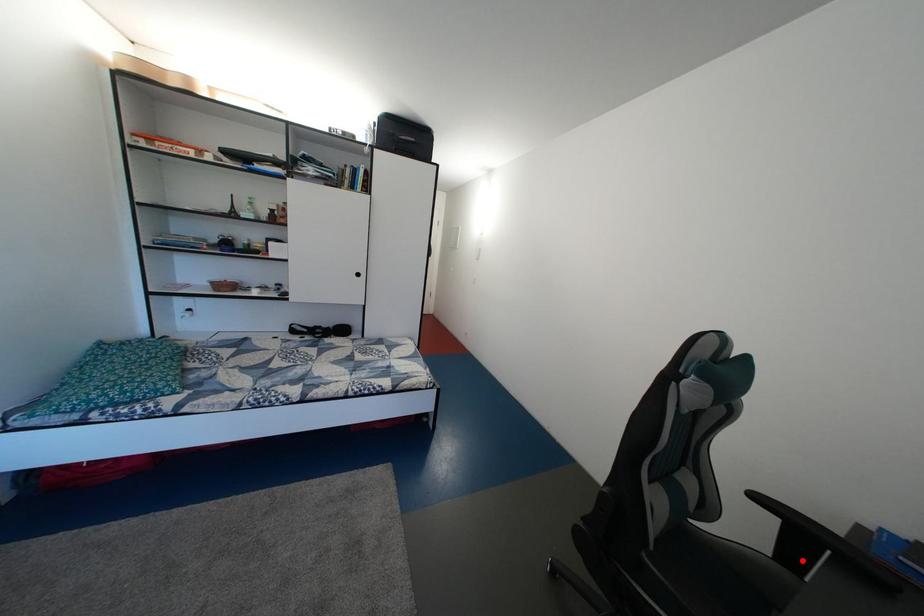
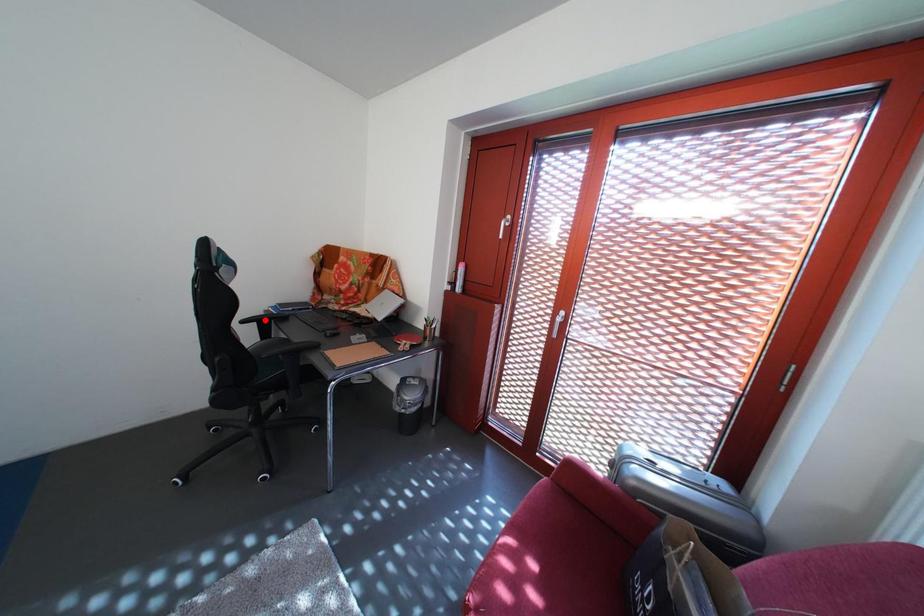
I am providing you with two images of the same scene from different viewpoints. A red point is marked on the first image and another point is marked on the second image. Are the points marked in image1 and image2 representing the same 3D position?

No